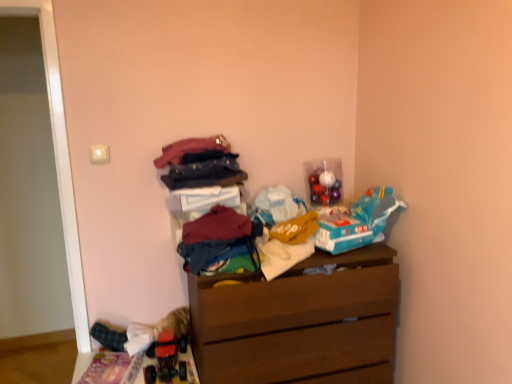
Question: From the image's perspective, is multicolored fabric pile at center, acting as the 1th clothing starting from the bottom, located above or below matte pink fabric at upper center, marked as the third clothing in a bottom-to-top arrangement?

Choices:
 (A) below
 (B) above

Answer: (A)

Question: Considering the relative positions of multicolored fabric pile at center, acting as the 1th clothing starting from the bottom, and matte pink fabric at upper center, marked as the first clothing in a top-to-bottom arrangement, in the image provided, is multicolored fabric pile at center, acting as the 1th clothing starting from the bottom, to the left or to the right of matte pink fabric at upper center, marked as the first clothing in a top-to-bottom arrangement,?

Choices:
 (A) right
 (B) left

Answer: (A)

Question: Which of these objects is positioned farthest from the multicolored fabric pile at center, acting as the 1th clothing starting from the bottom?

Choices:
 (A) rubberized plastic toy car at lower left, the 1th toy in the front-to-back sequence
 (B) dark red fabric at center, which ranks as the 2th clothing in bottom-to-top order
 (C) shiny metallic ornaments at upper right, the 2th toy when ordered from bottom to top
 (D) brown wooden chest of drawers at center
 (E) matte pink fabric at upper center, marked as the first clothing in a top-to-bottom arrangement

Answer: (C)

Question: Estimate the real-world distances between objects in this image. Which object is farther from the brown wooden chest of drawers at center?

Choices:
 (A) rubberized plastic toy car at lower left, the 1th toy in the front-to-back sequence
 (B) multicolored fabric pile at center, which is the third clothing from top to bottom
 (C) shiny metallic ornaments at upper right, placed as the 1th toy when sorted from back to front
 (D) matte pink fabric at upper center, marked as the first clothing in a top-to-bottom arrangement
 (E) dark red fabric at center, which ranks as the 2th clothing in bottom-to-top order

Answer: (D)